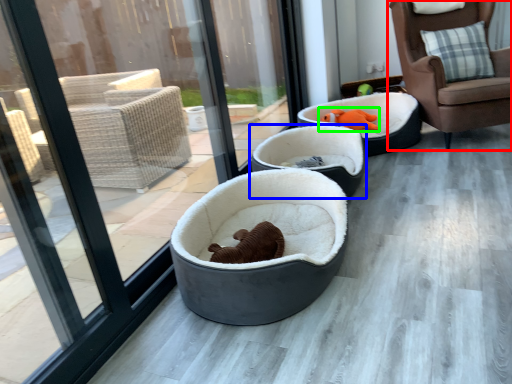
Question: Which is nearer to the chair (highlighted by a red box)? dog bed (highlighted by a blue box) or animal (highlighted by a green box).

Choices:
 (A) dog bed
 (B) animal

Answer: (B)